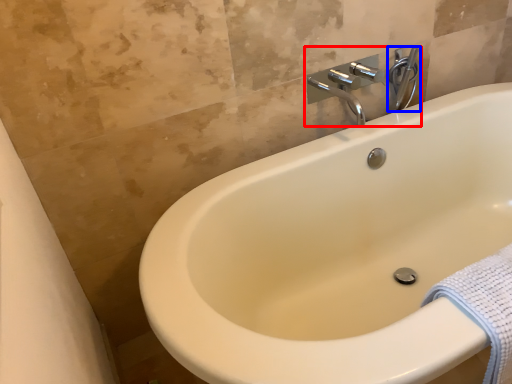
Question: Which point is closer to the camera, tap (highlighted by a red box) or plumbing fixture (highlighted by a blue box)?

Choices:
 (A) tap
 (B) plumbing fixture

Answer: (A)